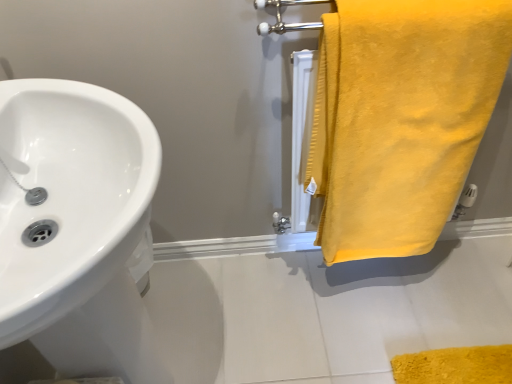
You are a GUI agent. You are given a task and a screenshot of the screen. Output one action in this format:
    pyautogui.click(x=<x>, y=<y>)
    Task: Click on the blank area beneath yellow soft towel at right (from a real-world perspective)
    This screenshot has width=512, height=384.
    Given the screenshot: What is the action you would take?
    pyautogui.click(x=370, y=281)